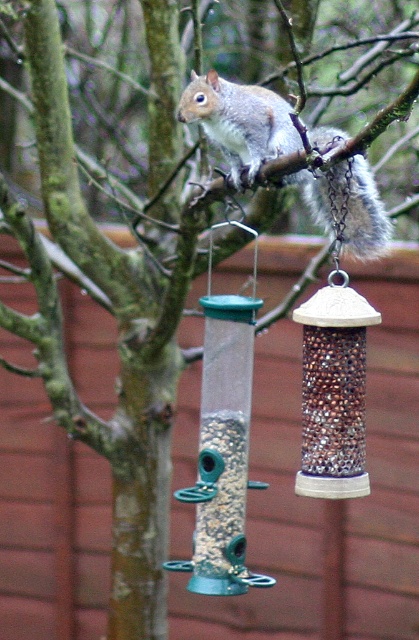
Question: Does gray furry squirrel at upper center come in front of brown textured seed at lower center?

Choices:
 (A) no
 (B) yes

Answer: (B)

Question: Which point is closer to the camera?

Choices:
 (A) (214, 442)
 (B) (338, 433)

Answer: (B)

Question: Which object appears farthest from the camera in this image?

Choices:
 (A) gray furry squirrel at upper center
 (B) shiny metallic seed at center
 (C) brown textured seed at lower center

Answer: (C)

Question: Among these points, which one is nearest to the camera?

Choices:
 (A) (235, 83)
 (B) (336, 472)
 (C) (209, 445)

Answer: (B)

Question: Considering the relative positions of shiny metallic seed at center and brown textured seed at lower center in the image provided, where is shiny metallic seed at center located with respect to brown textured seed at lower center?

Choices:
 (A) below
 (B) above

Answer: (B)

Question: Does shiny metallic seed at center have a smaller size compared to brown textured seed at lower center?

Choices:
 (A) no
 (B) yes

Answer: (B)